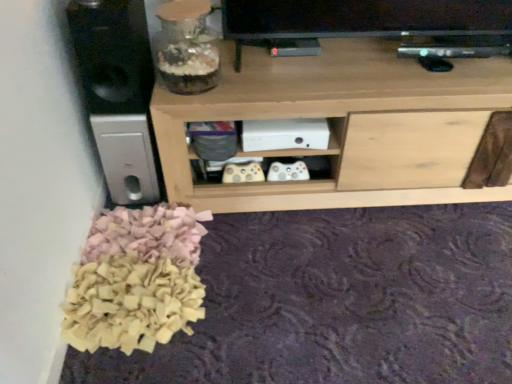
Question: From a real-world perspective, is black matte speaker at left on top of natural wood shelf at center?

Choices:
 (A) no
 (B) yes

Answer: (B)

Question: Is black matte speaker at left positioned with its back to natural wood shelf at center?

Choices:
 (A) yes
 (B) no

Answer: (B)

Question: Is the position of black matte speaker at left more distant than that of natural wood shelf at center?

Choices:
 (A) no
 (B) yes

Answer: (A)

Question: From the image's perspective, would you say black matte speaker at left is shown under natural wood shelf at center?

Choices:
 (A) no
 (B) yes

Answer: (A)

Question: Does black matte speaker at left have a greater height compared to natural wood shelf at center?

Choices:
 (A) yes
 (B) no

Answer: (B)

Question: From the image's perspective, is translucent glass jar at upper left positioned above or below natural wood shelf at center?

Choices:
 (A) below
 (B) above

Answer: (B)

Question: Considering the positions of point (176, 38) and point (248, 69), is point (176, 38) closer or farther from the camera than point (248, 69)?

Choices:
 (A) farther
 (B) closer

Answer: (B)

Question: Which is correct: translucent glass jar at upper left is inside natural wood shelf at center, or outside of it?

Choices:
 (A) outside
 (B) inside

Answer: (A)

Question: From a real-world perspective, is translucent glass jar at upper left physically located above or below natural wood shelf at center?

Choices:
 (A) below
 (B) above

Answer: (B)

Question: Would you say black matte speaker at left is inside or outside translucent glass jar at upper left?

Choices:
 (A) outside
 (B) inside

Answer: (A)

Question: In the image, is black matte speaker at left positioned in front of or behind translucent glass jar at upper left?

Choices:
 (A) front
 (B) behind

Answer: (A)

Question: From the image's perspective, is black matte speaker at left positioned above or below translucent glass jar at upper left?

Choices:
 (A) above
 (B) below

Answer: (A)

Question: From a real-world perspective, is black matte speaker at left above or below translucent glass jar at upper left?

Choices:
 (A) above
 (B) below

Answer: (B)

Question: Is point (330, 97) positioned closer to the camera than point (88, 105)?

Choices:
 (A) farther
 (B) closer

Answer: (B)

Question: From the image's perspective, relative to black matte speaker at left, is natural wood shelf at center above or below?

Choices:
 (A) below
 (B) above

Answer: (A)